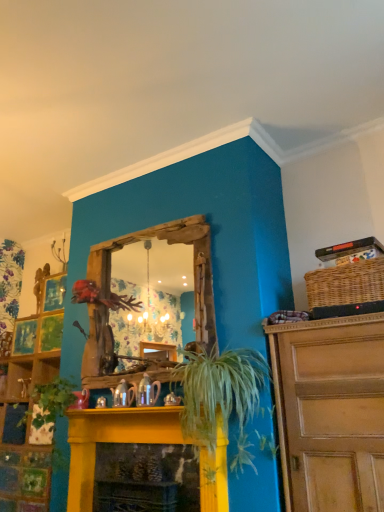
Question: Is green leafy plant at center taller or shorter than green matte plant at lower left?

Choices:
 (A) tall
 (B) short

Answer: (A)

Question: In the image, is green leafy plant at center positioned in front of or behind green matte plant at lower left?

Choices:
 (A) front
 (B) behind

Answer: (A)

Question: Which object is positioned closest to the green leafy plant at center?

Choices:
 (A) woven brown basket at upper right
 (B) green matte plant at lower left
 (C) yellow painted wood fireplace at center

Answer: (C)

Question: Considering the real-world distances, which object is closest to the woven brown basket at upper right?

Choices:
 (A) green matte plant at lower left
 (B) green leafy plant at center
 (C) yellow painted wood fireplace at center

Answer: (B)